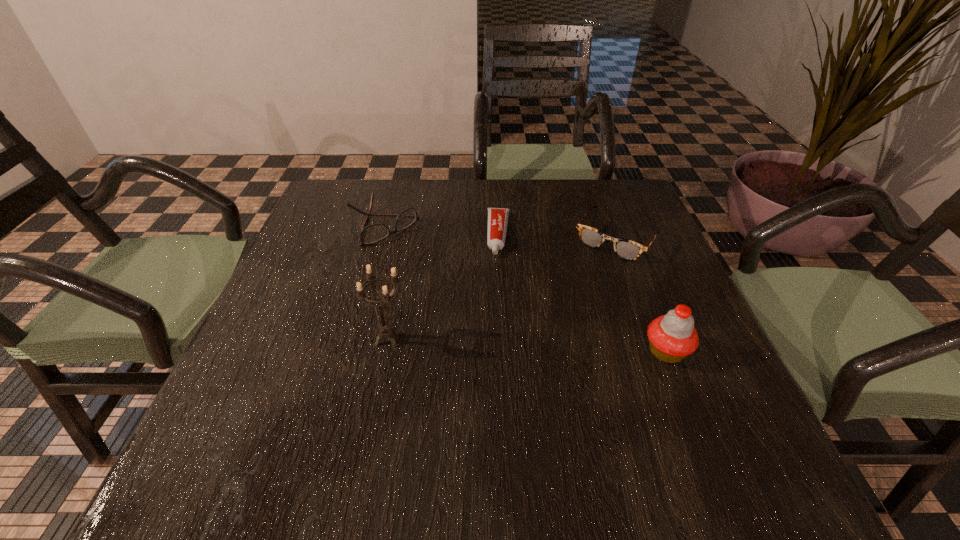
Locate an element on the screen. spectacles that is at the right edge is located at coordinates pos(625,249).

Locate an element on the screen. The width and height of the screenshot is (960, 540). object present at the far left corner is located at coordinates (373, 233).

You are a GUI agent. You are given a task and a screenshot of the screen. Output one action in this format:
    pyautogui.click(x=<x>, y=<y>)
    Task: Click on the object that is positioned at the far right corner
    The image size is (960, 540).
    Given the screenshot: What is the action you would take?
    pyautogui.click(x=625, y=249)

The width and height of the screenshot is (960, 540). In the image, there is a desktop. Find the location of `vacant space at the far edge`. vacant space at the far edge is located at coordinates [x=429, y=219].

Locate an element on the screen. free space at the near edge of the desktop is located at coordinates pyautogui.click(x=642, y=419).

I want to click on vacant space at the left edge, so click(256, 344).

Where is `blank space at the right edge`? blank space at the right edge is located at coordinates (624, 234).

You are a GUI agent. You are given a task and a screenshot of the screen. Output one action in this format:
    pyautogui.click(x=<x>, y=<y>)
    Task: Click on the vacant space at the near left corner of the desktop
    Image resolution: width=960 pixels, height=540 pixels.
    Given the screenshot: What is the action you would take?
    pyautogui.click(x=220, y=399)

The height and width of the screenshot is (540, 960). In the image, there is a desktop. Find the location of `free space at the near right corner`. free space at the near right corner is located at coordinates click(x=663, y=422).

Identify the location of vacant area that lies between the cupcake and the shortest object. The width and height of the screenshot is (960, 540). (583, 293).